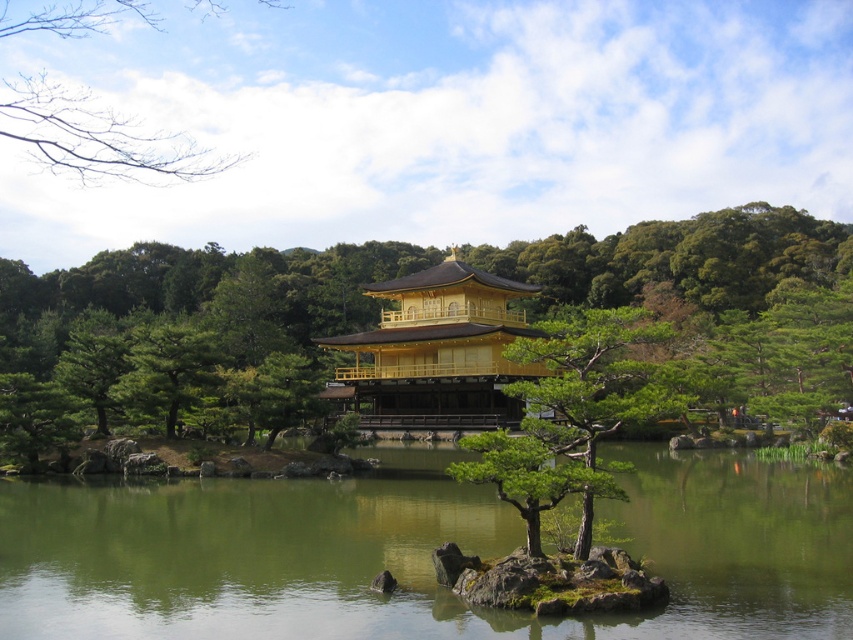
You are a landscape architect designing a new garden. You want to place a small statue between the green glossy tree at center and the bare branches at upper left. Which object should the statue be closer to if you want it to appear balanced in the composition?

The statue should be closer to the green glossy tree at center because it occupies less space than the bare branches at upper left, creating a balanced visual weight.

You are a visitor at the Golden Pavilion and want to take a photo of the green glossy tree at center and the green liquid water at center. Which object should you focus on first if you want to capture both in a single shot without moving the camera?

You should focus on the green glossy tree at center first because the green liquid water at center is positioned under it, so adjusting the focus to the tree will naturally include the water below in the frame.

You are standing on the wooden deck of the Golden Pavilion and want to know where the green liquid water at center is located relative to your position. Can you describe its position using coordinates?

The green liquid water at center is located at coordinates point [419,552].